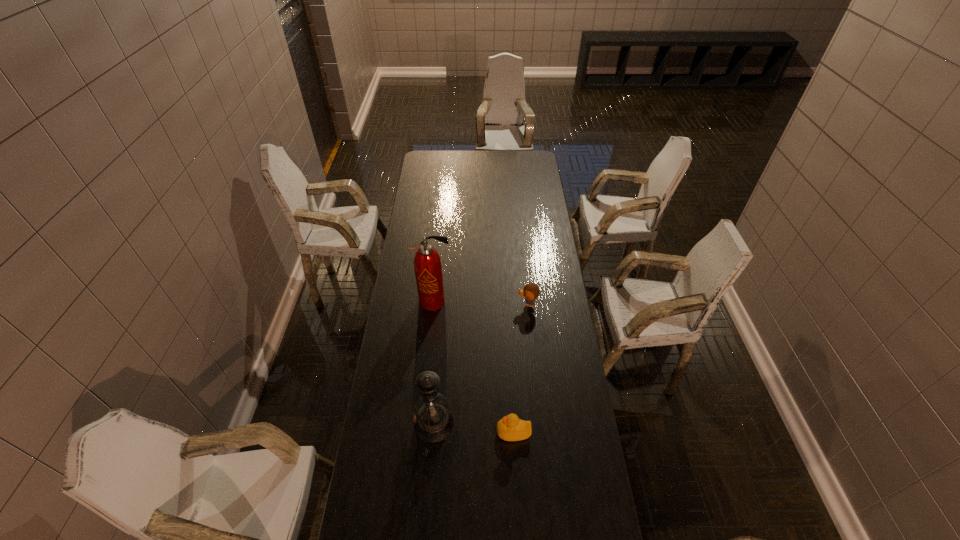
The width and height of the screenshot is (960, 540). Find the location of `fire extinguisher`. fire extinguisher is located at coordinates (427, 263).

Image resolution: width=960 pixels, height=540 pixels. Identify the location of the third shortest object. (433, 422).

Image resolution: width=960 pixels, height=540 pixels. Identify the location of the farther duck. (531, 291).

Find the location of a particular element. Image resolution: width=960 pixels, height=540 pixels. the nearer duck is located at coordinates (510, 428).

Image resolution: width=960 pixels, height=540 pixels. Find the location of `free space located 0.320m on the front of the fire extinguisher`. free space located 0.320m on the front of the fire extinguisher is located at coordinates (427, 376).

Locate an element on the screen. This screenshot has height=540, width=960. vacant region located on the back of the oil lamp is located at coordinates tap(442, 328).

At what (x,y) coordinates should I click in order to perform the action: click on vacant space located 0.280m on the front-facing side of the farther duck. Please return your answer as a coordinate pair (x, y). Looking at the image, I should click on (453, 304).

The width and height of the screenshot is (960, 540). Find the location of `vacant space situated 0.300m on the front-facing side of the farther duck`. vacant space situated 0.300m on the front-facing side of the farther duck is located at coordinates (448, 304).

I want to click on free space located 0.300m on the front-facing side of the farther duck, so click(448, 304).

This screenshot has height=540, width=960. What are the coordinates of `free region located on the face of the nearer duck` in the screenshot? It's located at (x=381, y=432).